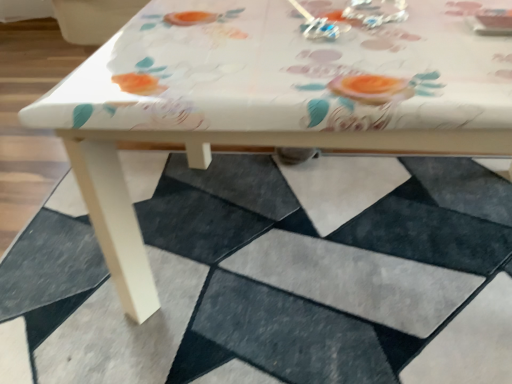
Question: In terms of height, does metallic silver earrings at upper center look taller or shorter compared to white matte rug at lower center?

Choices:
 (A) tall
 (B) short

Answer: (B)

Question: In the image, is metallic silver earrings at upper center positioned in front of or behind white matte rug at lower center?

Choices:
 (A) behind
 (B) front

Answer: (A)

Question: Is metallic silver earrings at upper center wider or thinner than white matte rug at lower center?

Choices:
 (A) thin
 (B) wide

Answer: (A)

Question: Would you say white matte rug at lower center is to the left or to the right of metallic silver earrings at upper center in the picture?

Choices:
 (A) left
 (B) right

Answer: (A)

Question: From a real-world perspective, is white matte rug at lower center above or below metallic silver earrings at upper center?

Choices:
 (A) above
 (B) below

Answer: (B)

Question: Does point click(19, 273) appear closer or farther from the camera than point click(312, 26)?

Choices:
 (A) closer
 (B) farther

Answer: (B)

Question: From the image's perspective, is white matte rug at lower center positioned above or below metallic silver earrings at upper center?

Choices:
 (A) below
 (B) above

Answer: (A)